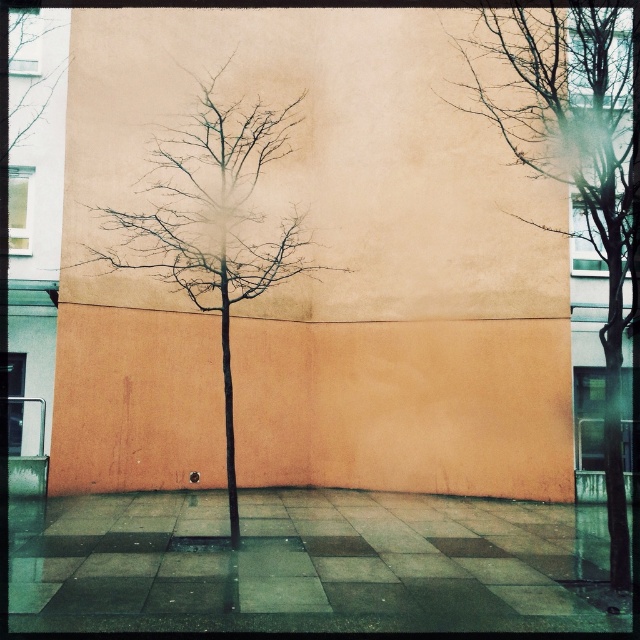
You are a city planner designing a new park and want to place a bench near the brown bark tree at center. According to the image, where should you place the bench relative to the tree to ensure it is within the paved area?

The bench should be placed to the right of the brown bark tree at center since the paved area extends to the right side of the frame as indicated by the square tiles in muted tones of gray and brown.

You are a city planner assessing the urban space shown. You need to determine which of the two sets of bare branches, the bare branches at center or the bare branches at upper left, is closer to the ground. Based on the scene description, which one is lower?

The bare branches at center has a lesser height compared to the bare branches at upper left, so the bare branches at center is closer to the ground.

You are a city planner analyzing the urban space in the image. You need to determine which area has more visual obstruction caused by the branches. Based on the positions of the bare branches at center and the bare branches at upper left, which one creates a larger visual obstruction?

The bare branches at upper left create a larger visual obstruction because they occupy more space than the bare branches at center.